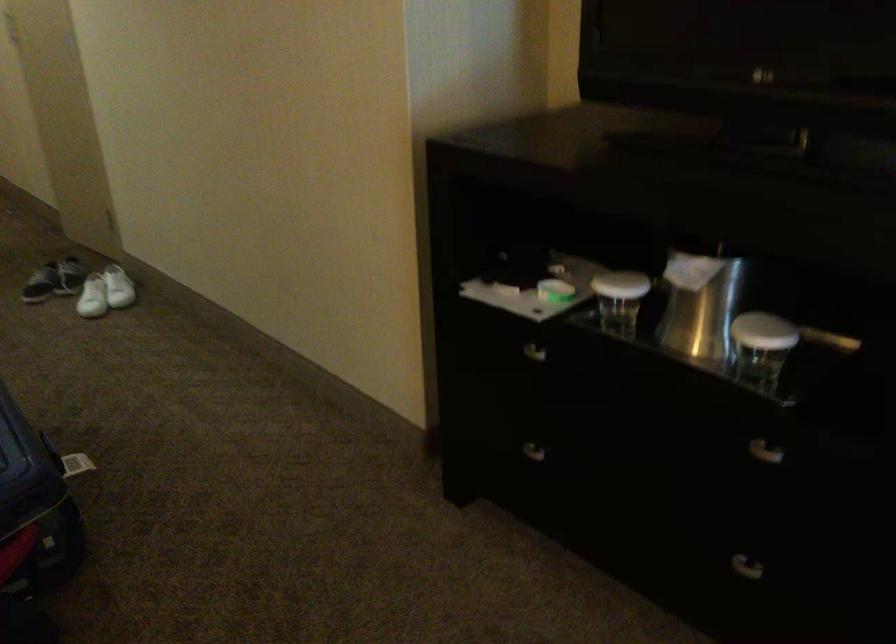
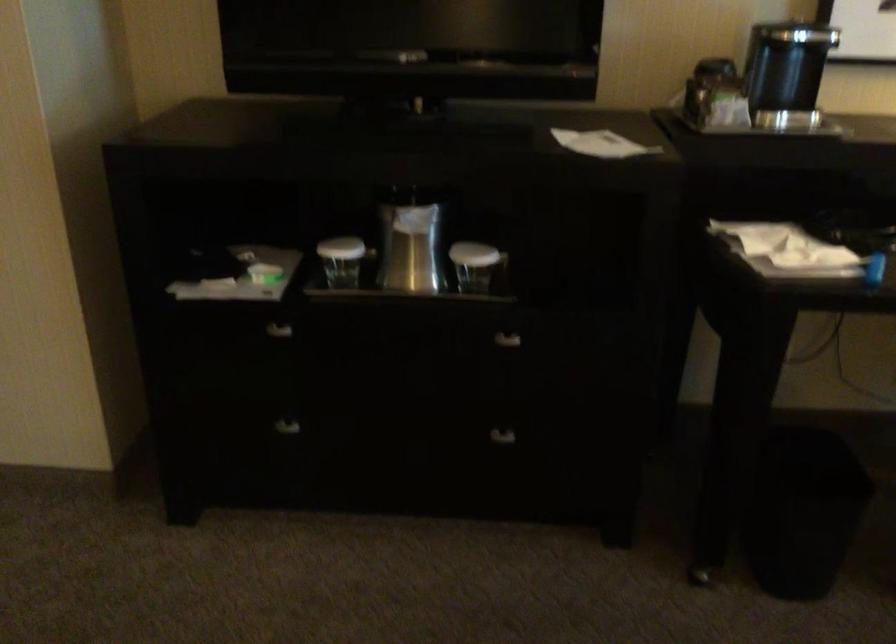
Question: The images are taken continuously from a first-person perspective. In which direction is your viewpoint rotating?

Choices:
 (A) Left
 (B) Right
 (C) Up
 (D) Down

Answer: (B)